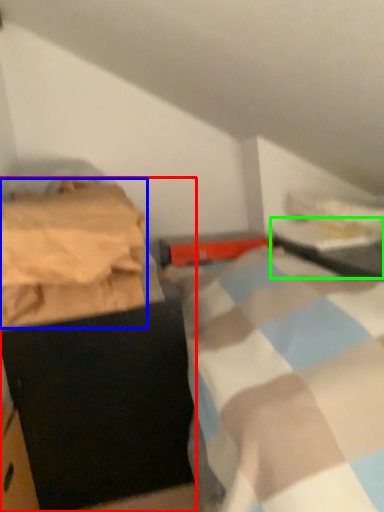
Question: Which object is the farthest from furniture (highlighted by a red box)? Choose among these: blanket (highlighted by a blue box) or table (highlighted by a green box).

Choices:
 (A) blanket
 (B) table

Answer: (B)